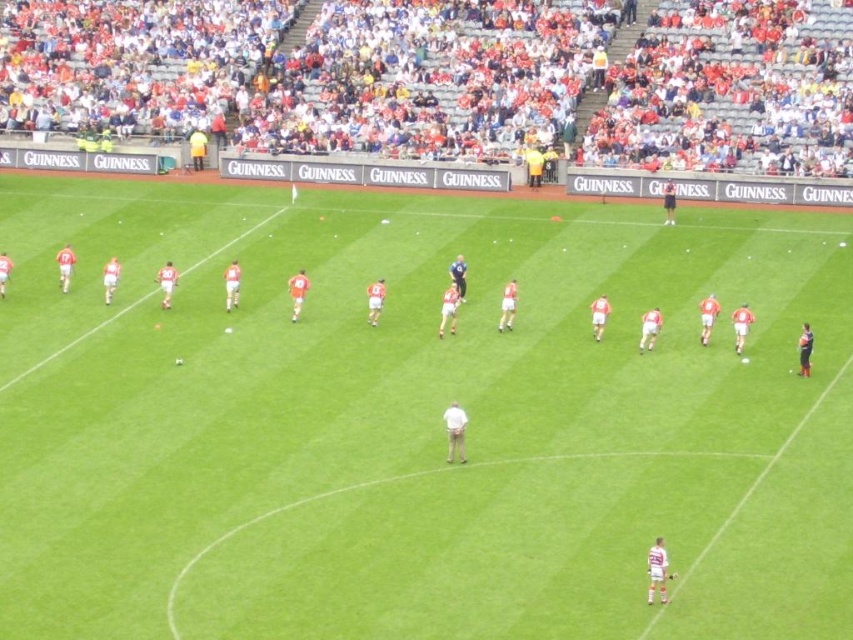
Question: Is the position of green grass field at center more distant than that of white plastic seats at upper center?

Choices:
 (A) no
 (B) yes

Answer: (A)

Question: In this image, where is white matte soccer ball at center located relative to blue fabric jacket at center?

Choices:
 (A) above
 (B) below

Answer: (B)

Question: Estimate the real-world distances between objects in this image. Which object is farther from the white plastic seats at upper center?

Choices:
 (A) green grass field at center
 (B) white matte soccer ball at center
 (C) blue fabric jacket at center

Answer: (B)

Question: Which object appears closest to the camera in this image?

Choices:
 (A) white matte soccer ball at center
 (B) blue fabric jacket at center

Answer: (A)

Question: Does white jersey at center have a greater width compared to white matte soccer ball at center?

Choices:
 (A) yes
 (B) no

Answer: (A)

Question: Which of the following is the farthest from the observer?

Choices:
 (A) white matte soccer ball at center
 (B) blue fabric jacket at center
 (C) white plastic seats at upper center
 (D) white jersey at center

Answer: (C)